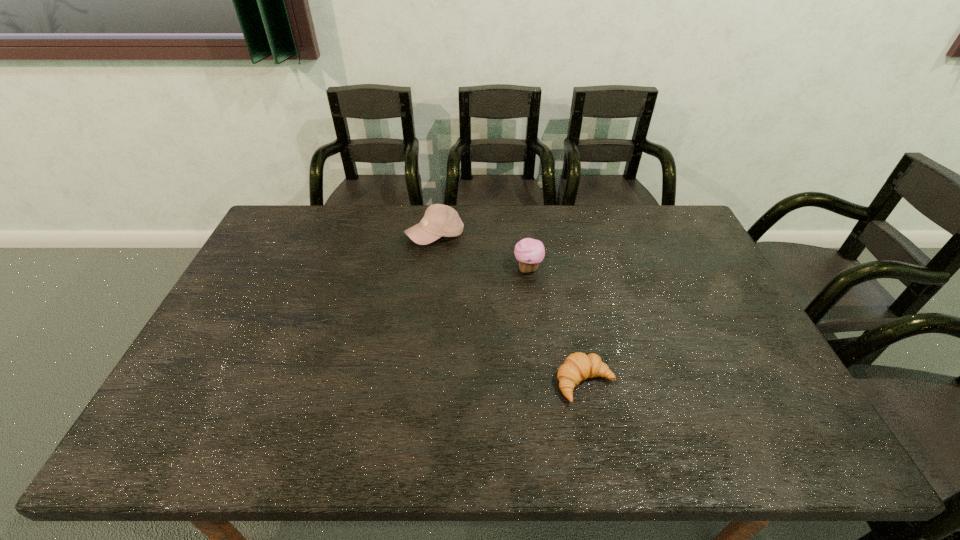
You are a GUI agent. You are given a task and a screenshot of the screen. Output one action in this format:
    pyautogui.click(x=<x>, y=<y>)
    Task: Click on the cupcake
    
    Given the screenshot: What is the action you would take?
    pyautogui.click(x=529, y=252)

Where is `baseball cap`? The height and width of the screenshot is (540, 960). baseball cap is located at coordinates (439, 220).

You are a GUI agent. You are given a task and a screenshot of the screen. Output one action in this format:
    pyautogui.click(x=<x>, y=<y>)
    Task: Click on the leftmost object
    
    Given the screenshot: What is the action you would take?
    pyautogui.click(x=439, y=220)

At what (x,y) coordinates should I click in order to perform the action: click on crescent roll. Please return your answer as a coordinate pair (x, y). The height and width of the screenshot is (540, 960). Looking at the image, I should click on (578, 366).

The image size is (960, 540). In order to click on the nearest object in this screenshot , I will do `click(578, 366)`.

Identify the location of vacant region located on the left of the cupcake. (413, 269).

You are a GUI agent. You are given a task and a screenshot of the screen. Output one action in this format:
    pyautogui.click(x=<x>, y=<y>)
    Task: Click on the vacant space situated 0.390m on the front-facing side of the leftmost object
    The height and width of the screenshot is (540, 960).
    Given the screenshot: What is the action you would take?
    pyautogui.click(x=422, y=343)

This screenshot has height=540, width=960. In order to click on vacant space located on the right of the nearest object in this screenshot , I will do (x=671, y=383).

Locate an element on the screen. Image resolution: width=960 pixels, height=540 pixels. object located at the far edge is located at coordinates (439, 220).

This screenshot has width=960, height=540. I want to click on vacant space at the far edge of the desktop, so click(524, 220).